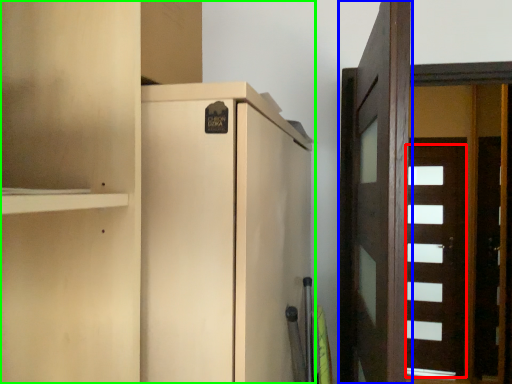
Question: Considering the real-world distances, which object is closest to door (highlighted by a red box)? door (highlighted by a blue box) or cupboard (highlighted by a green box).

Choices:
 (A) door
 (B) cupboard

Answer: (A)